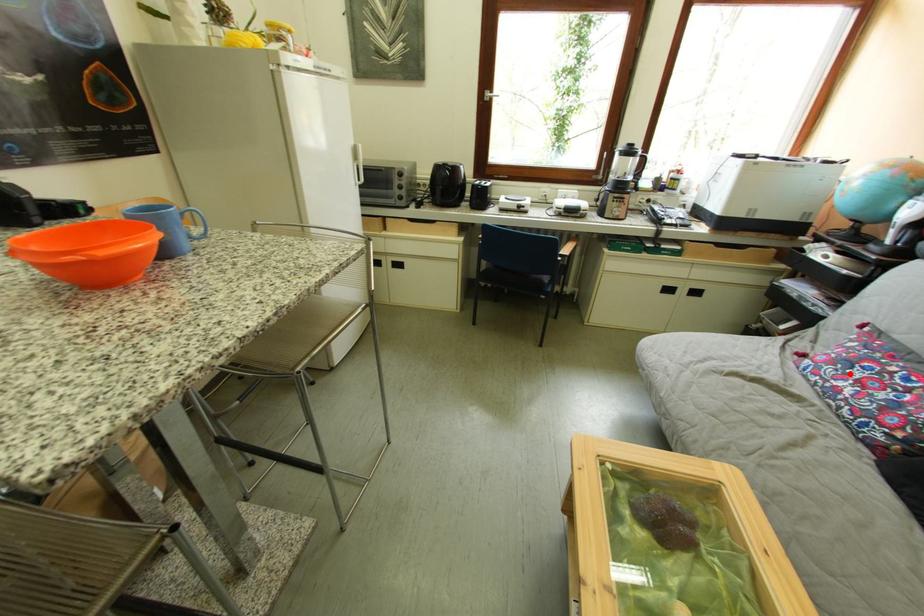
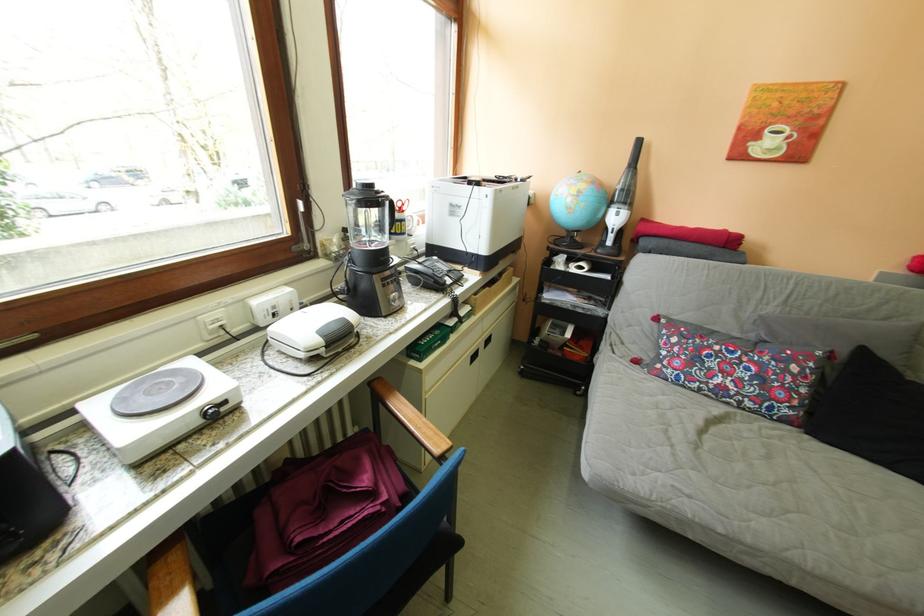
Locate, in the second image, the point that corresponds to the highlighted location in the first image.

(714, 373)